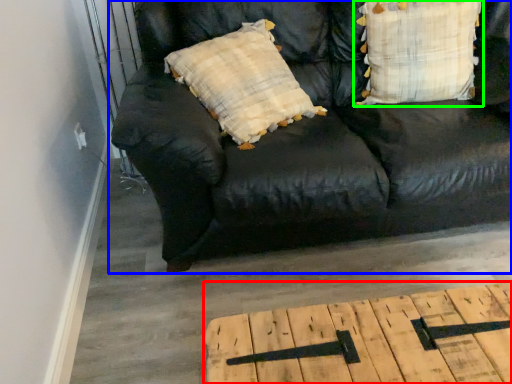
Question: Which object is positioned farthest from table (highlighted by a red box)? Select from studio couch (highlighted by a blue box) and pillow (highlighted by a green box).

Choices:
 (A) studio couch
 (B) pillow

Answer: (B)